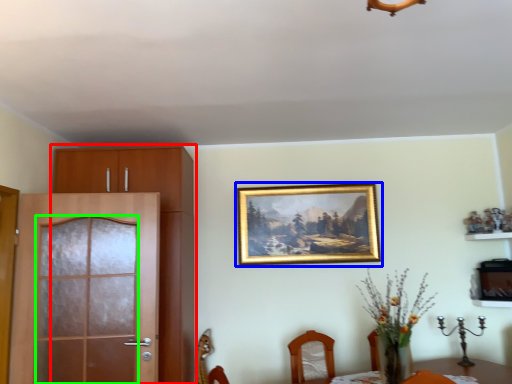
Question: Which object is the closest to the cabinetry (highlighted by a red box)? Choose among these: picture frame (highlighted by a blue box) or screen door (highlighted by a green box).

Choices:
 (A) picture frame
 (B) screen door

Answer: (B)